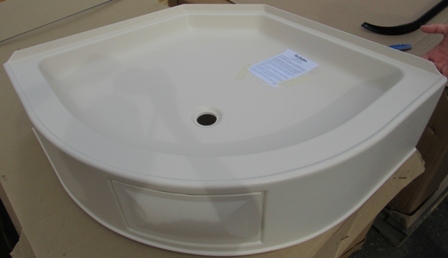
Where is `shower pan`? The width and height of the screenshot is (448, 258). shower pan is located at coordinates (306, 125).